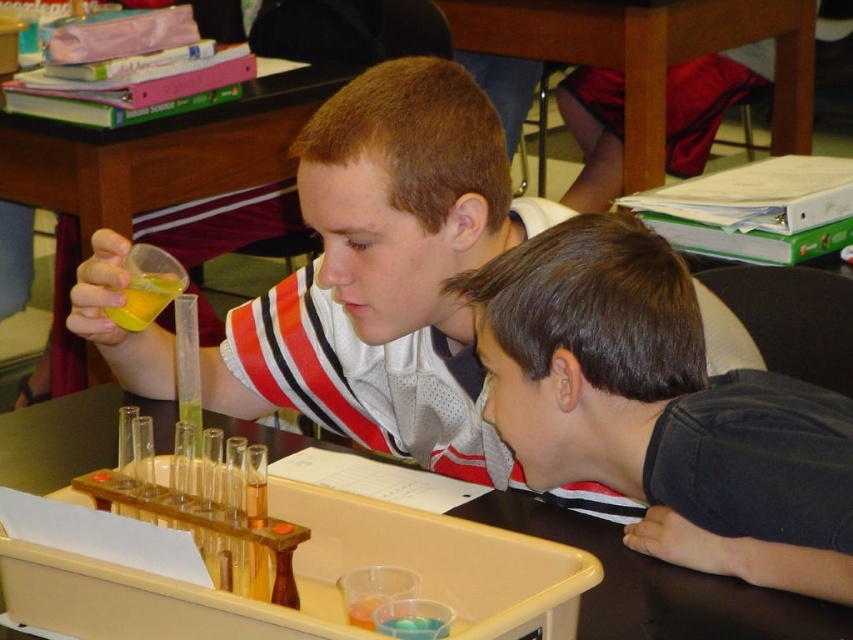
Question: Is wooden table at upper center positioned behind translucent plastic test tube at upper center?

Choices:
 (A) yes
 (B) no

Answer: (A)

Question: Is matte plastic test tube at center positioned at the back of dark gray shirt at lower right?

Choices:
 (A) yes
 (B) no

Answer: (A)

Question: Which point is farther to the camera?

Choices:
 (A) (137, 305)
 (B) (602, 627)
 (C) (793, 134)
 (D) (335, 332)

Answer: (C)

Question: Estimate the real-world distances between objects in this image. Which object is closer to the yellow translucent cup at upper left?

Choices:
 (A) wooden table at upper center
 (B) translucent plastic test tube at upper center
 (C) matte plastic test tube at center
 (D) dark gray shirt at lower right

Answer: (C)

Question: From the image, what is the correct spatial relationship of dark gray shirt at lower right in relation to wooden table at upper center?

Choices:
 (A) below
 (B) above

Answer: (A)

Question: Which point is closer to the camera?

Choices:
 (A) (577, 522)
 (B) (563, 44)

Answer: (A)